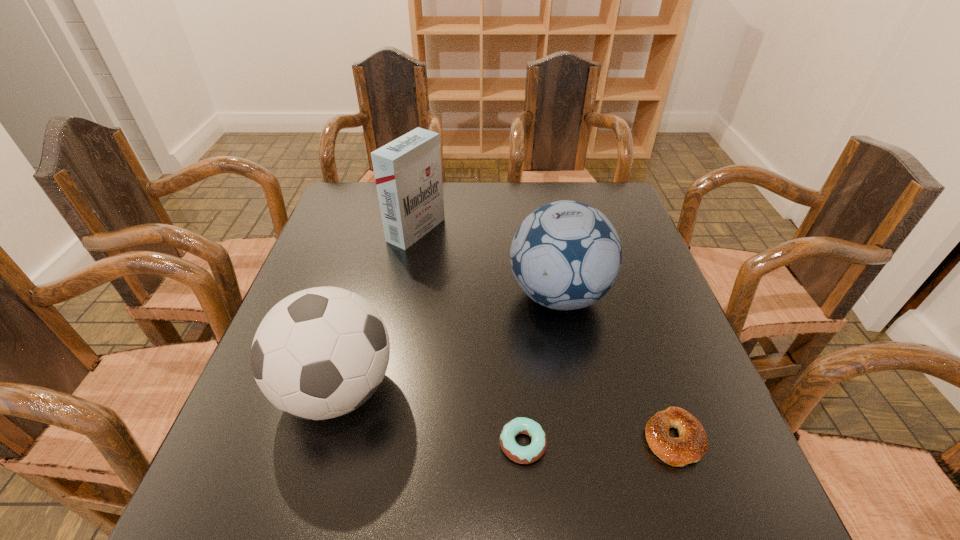
This screenshot has width=960, height=540. I want to click on the farthest object, so click(408, 173).

At what (x,y) coordinates should I click in order to perform the action: click on the second farthest object. Please return your answer as a coordinate pair (x, y). This screenshot has height=540, width=960. Looking at the image, I should click on (566, 255).

Locate an element on the screen. This screenshot has width=960, height=540. the right soccer ball is located at coordinates (566, 255).

You are a GUI agent. You are given a task and a screenshot of the screen. Output one action in this format:
    pyautogui.click(x=<x>, y=<y>)
    Task: Click on the nearer soccer ball
    The height and width of the screenshot is (540, 960).
    Given the screenshot: What is the action you would take?
    pyautogui.click(x=320, y=353)

At what (x,y) coordinates should I click in order to perform the action: click on bagel. Please return your answer as a coordinate pair (x, y). The height and width of the screenshot is (540, 960). Looking at the image, I should click on (692, 443).

Locate an element on the screen. doughnut is located at coordinates (528, 454).

You are a GUI agent. You are given a task and a screenshot of the screen. Output one action in this format:
    pyautogui.click(x=<x>, y=<y>)
    Task: Click on the free space located on the front of the farthest object
    This screenshot has width=960, height=540.
    Given the screenshot: What is the action you would take?
    (396, 339)

Where is `free spot located on the side with brand of the right soccer ball`? free spot located on the side with brand of the right soccer ball is located at coordinates point(447,295).

Where is `free space located on the side with brand of the right soccer ball`? free space located on the side with brand of the right soccer ball is located at coordinates (371, 295).

This screenshot has height=540, width=960. In order to click on free spot located 0.260m on the side with brand of the right soccer ball in this screenshot , I will do `click(403, 295)`.